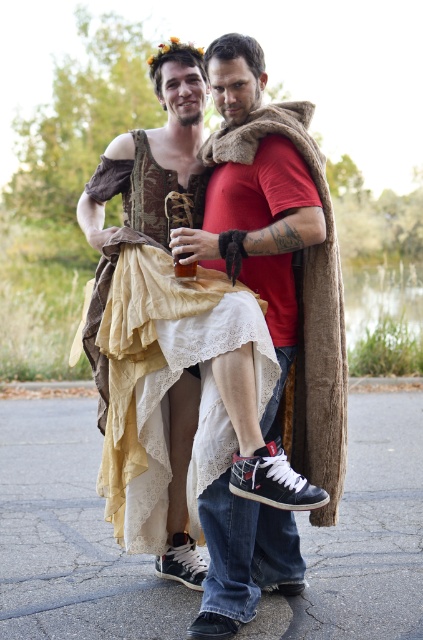
Question: Observing the image, what is the correct spatial positioning of matte brown fabric dress at center in reference to translucent glass beverage at center?

Choices:
 (A) right
 (B) left

Answer: (A)

Question: Can you confirm if matte brown fabric dress at center is positioned to the left of translucent glass beverage at center?

Choices:
 (A) no
 (B) yes

Answer: (A)

Question: Among these objects, which one is farthest from the camera?

Choices:
 (A) translucent glass beverage at center
 (B) matte brown fabric dress at center

Answer: (A)

Question: Which object is farther from the camera taking this photo?

Choices:
 (A) matte brown fabric dress at center
 (B) translucent glass beverage at center

Answer: (B)

Question: Which of the following is the farthest from the observer?

Choices:
 (A) (176, 257)
 (B) (206, 216)

Answer: (B)

Question: Can you confirm if matte brown fabric dress at center is thinner than translucent glass beverage at center?

Choices:
 (A) no
 (B) yes

Answer: (A)